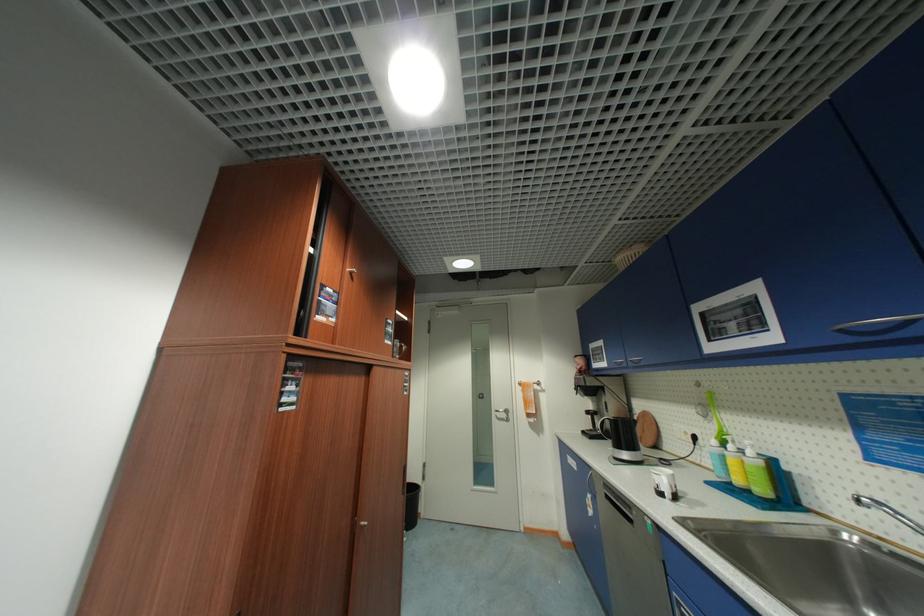
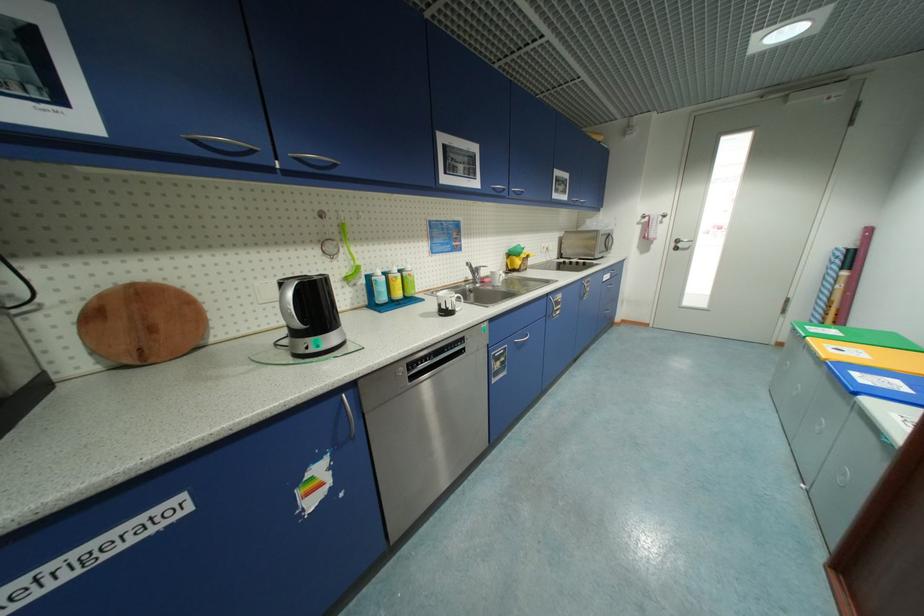
Where in the second image is the point corresponding to (x=847, y=331) from the first image?

(499, 190)